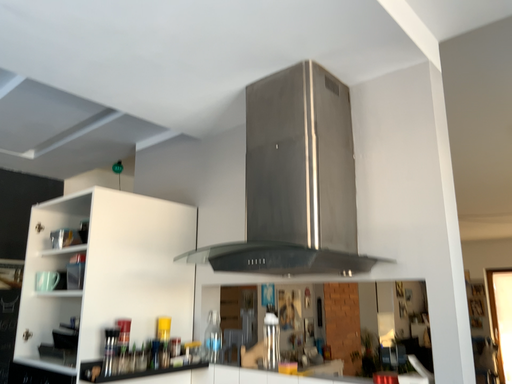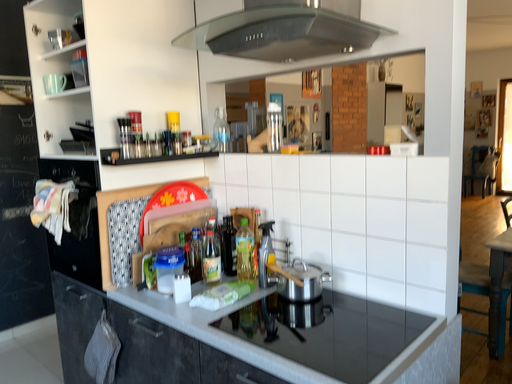
Question: How did the camera likely rotate when shooting the video?

Choices:
 (A) rotated downward
 (B) rotated upward

Answer: (A)